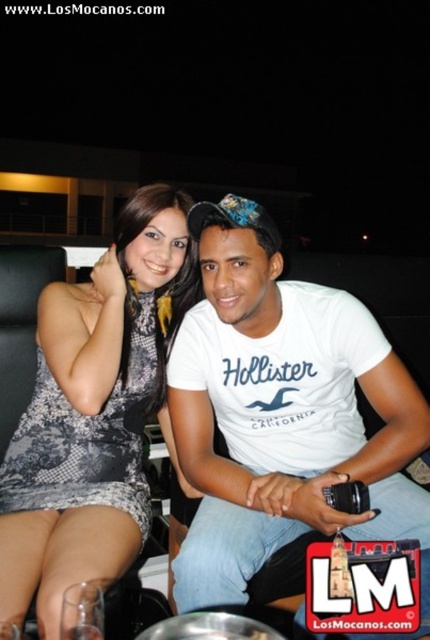
Is white cotton t-shirt at center shorter than black lace dress at center?

No.

Measure the distance between white cotton t-shirt at center and black lace dress at center.

They are 10.45 inches apart.

Does point (189, 481) come farther from viewer compared to point (51, 557)?

Yes.

You are a GUI agent. You are given a task and a screenshot of the screen. Output one action in this format:
    pyautogui.click(x=<x>, y=<y>)
    Task: Click on the white cotton t-shirt at center
    Image resolution: width=430 pixels, height=640 pixels.
    Given the screenshot: What is the action you would take?
    pyautogui.click(x=282, y=412)